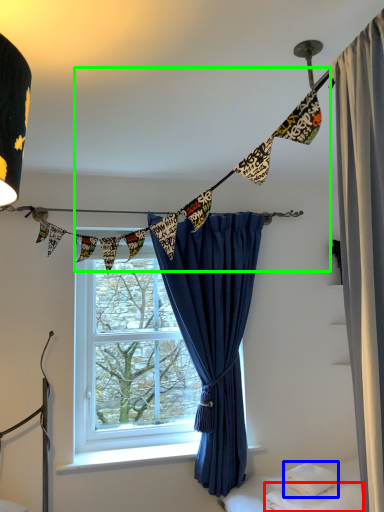
Question: Estimate the real-world distances between objects in this image. Which object is farther from sheet (highlighted by a red box), pillow (highlighted by a blue box) or clothesline (highlighted by a green box)?

Choices:
 (A) pillow
 (B) clothesline

Answer: (B)